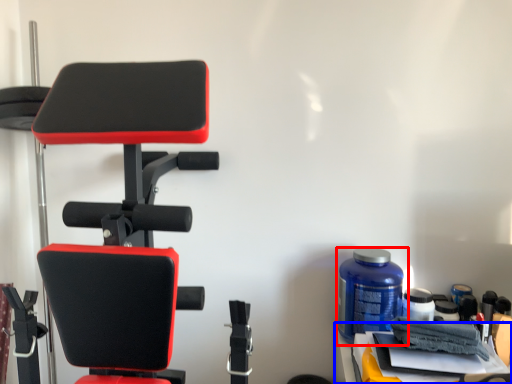
Question: Which object is further to the camera taking this photo, bottle (highlighted by a red box) or table (highlighted by a blue box)?

Choices:
 (A) bottle
 (B) table

Answer: (A)